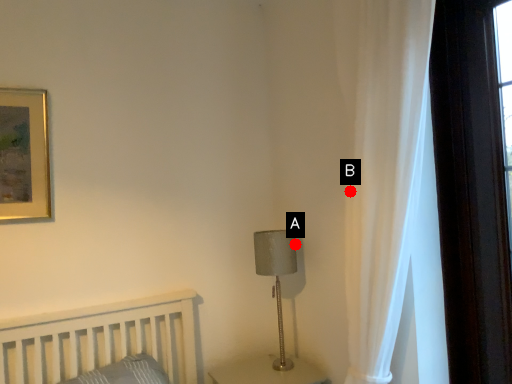
Question: Two points are circled on the image, labeled by A and B beside each circle. Which point is closer to the camera taking this photo?

Choices:
 (A) A is closer
 (B) B is closer

Answer: (B)